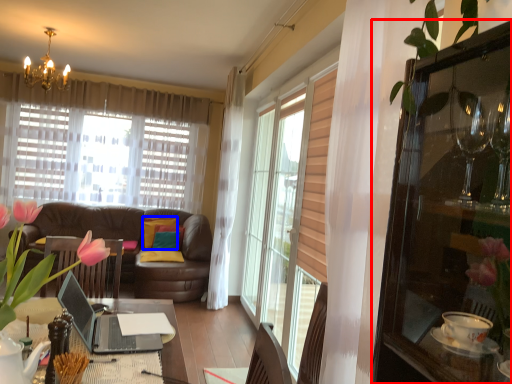
Question: Which point is closer to the camera, cabinetry (highlighted by a red box) or pillow (highlighted by a blue box)?

Choices:
 (A) cabinetry
 (B) pillow

Answer: (A)